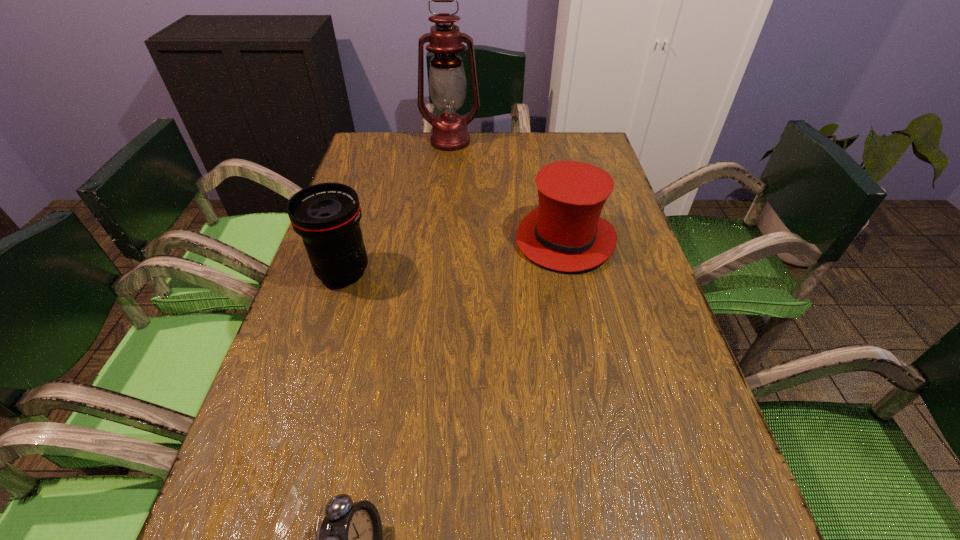
The height and width of the screenshot is (540, 960). What are the coordinates of `object that ranks as the second closest to the hat` in the screenshot? It's located at (326, 215).

Point out which object is positioned as the nearest to the tallest object. Please provide its 2D coordinates. Your answer should be formatted as a tuple, i.e. [(x, y)], where the tuple contains the x and y coordinates of a point satisfying the conditions above.

[(565, 232)]